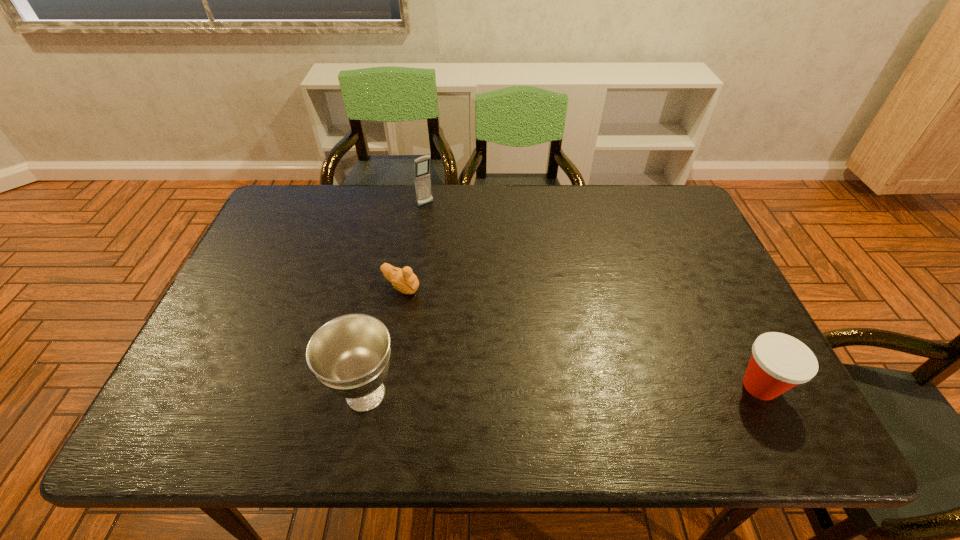
Find the location of a particular element. The image size is (960, 540). chalice is located at coordinates (350, 355).

Locate an element on the screen. This screenshot has height=540, width=960. the second shortest object is located at coordinates (779, 362).

This screenshot has height=540, width=960. Find the location of `the rightmost object`. the rightmost object is located at coordinates (779, 362).

You are a GUI agent. You are given a task and a screenshot of the screen. Output one action in this format:
    pyautogui.click(x=<x>, y=<y>)
    Task: Click on the second farthest object
    Image resolution: width=960 pixels, height=540 pixels.
    Given the screenshot: What is the action you would take?
    pyautogui.click(x=404, y=280)

Find the location of `the shortest object`. the shortest object is located at coordinates (404, 280).

Find the location of a particular element. The height and width of the screenshot is (540, 960). cellular telephone is located at coordinates tap(422, 181).

Locate an element on the screen. The width and height of the screenshot is (960, 540). free space located 0.250m on the back of the chalice is located at coordinates (388, 284).

Where is `vacant space located 0.150m on the back of the Dixie cup`? The height and width of the screenshot is (540, 960). vacant space located 0.150m on the back of the Dixie cup is located at coordinates (724, 313).

Where is `vacant space situated 0.240m on the face of the shortest object`? This screenshot has width=960, height=540. vacant space situated 0.240m on the face of the shortest object is located at coordinates (492, 336).

Image resolution: width=960 pixels, height=540 pixels. In order to click on vacant space located on the face of the shortest object in this screenshot , I will do `click(446, 310)`.